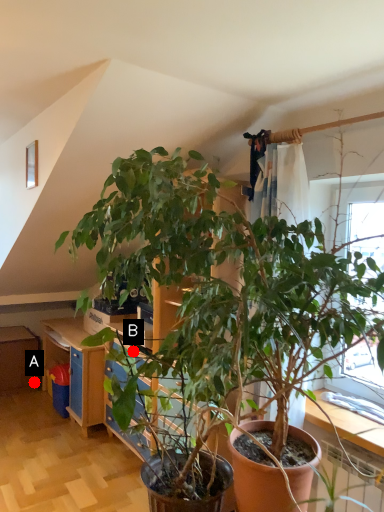
Question: Two points are circled on the image, labeled by A and B beside each circle. Which point is closer to the camera taking this photo?

Choices:
 (A) A is closer
 (B) B is closer

Answer: (B)